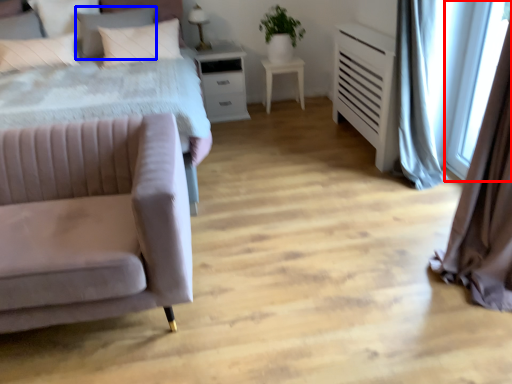
Question: Among these objects, which one is nearest to the camera, window screen (highlighted by a red box) or pillow (highlighted by a blue box)?

Choices:
 (A) window screen
 (B) pillow

Answer: (A)